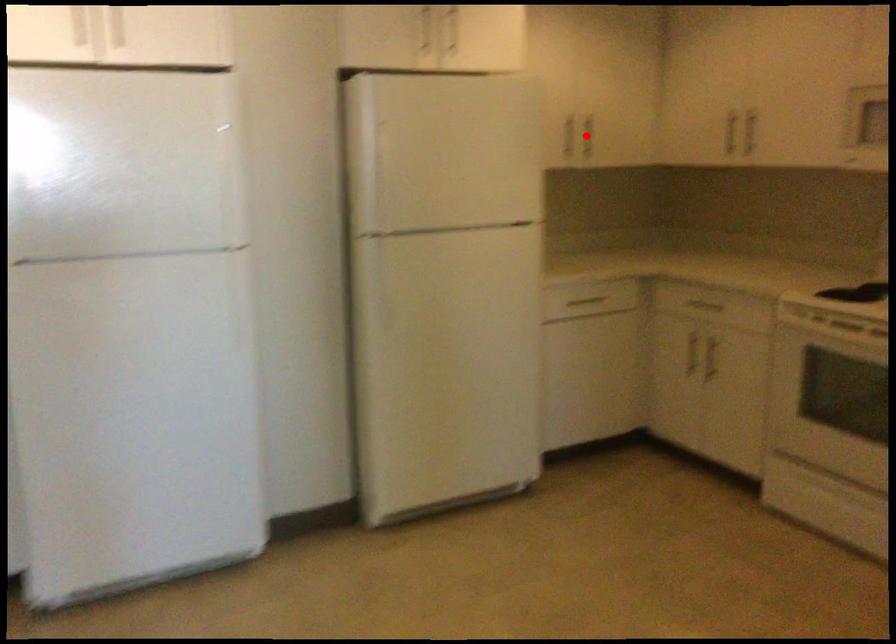
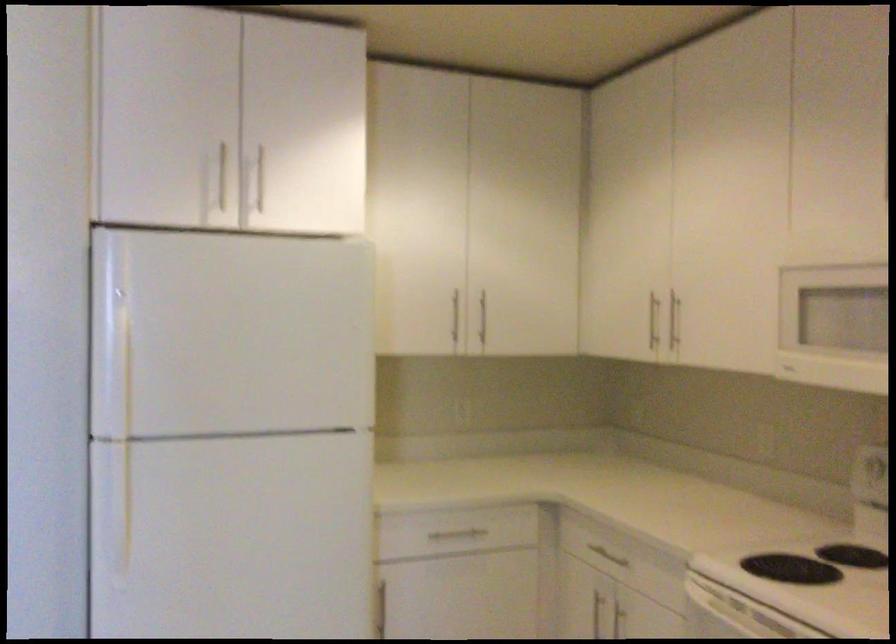
The point at the highlighted location is marked in the first image. Where is the corresponding point in the second image?

(483, 317)